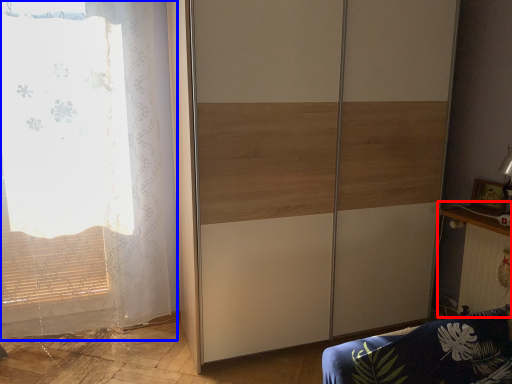
Question: Which of the following is the closest to the observer, table (highlighted by a red box) or curtain (highlighted by a blue box)?

Choices:
 (A) table
 (B) curtain

Answer: (B)